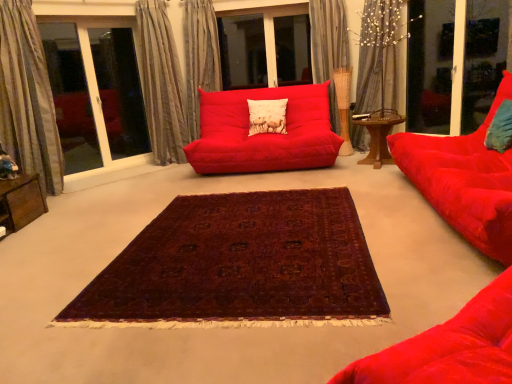
Question: Does matte red studio couch at center, the 2th studio couch positioned from the right, appear on the left side of matte white cushion at center, acting as the second pillow starting from the front?

Choices:
 (A) no
 (B) yes

Answer: (B)

Question: Would you say matte white cushion at center, which is the first pillow in back-to-front order, is part of matte red studio couch at center, the 2th studio couch positioned from the right,'s contents?

Choices:
 (A) yes
 (B) no

Answer: (A)

Question: From the image's perspective, is matte red studio couch at center, the 2th studio couch positioned from the right, beneath matte white cushion at center, positioned as the 1th pillow in left-to-right order?

Choices:
 (A) no
 (B) yes

Answer: (B)

Question: Are matte red studio couch at center, which is counted as the 1th studio couch, starting from the left, and matte white cushion at center, acting as the second pillow starting from the front, far apart?

Choices:
 (A) no
 (B) yes

Answer: (A)

Question: Is matte red studio couch at center, which is counted as the first studio couch, starting from the back, positioned behind matte white cushion at center, which is counted as the second pillow, starting from the right?

Choices:
 (A) no
 (B) yes

Answer: (A)

Question: Is matte red studio couch at center, which is counted as the first studio couch, starting from the back, smaller than matte white cushion at center, which is counted as the second pillow, starting from the right?

Choices:
 (A) yes
 (B) no

Answer: (B)

Question: From a real-world perspective, is transparent glass screen door at upper right located higher than silky gray curtain at upper left, which appears as the second curtain when viewed from the left?

Choices:
 (A) yes
 (B) no

Answer: (B)

Question: Is transparent glass screen door at upper right outside of silky gray curtain at upper left, which appears as the second curtain when viewed from the left?

Choices:
 (A) yes
 (B) no

Answer: (A)

Question: Does transparent glass screen door at upper right have a greater width compared to silky gray curtain at upper left, placed as the fourth curtain when sorted from right to left?

Choices:
 (A) no
 (B) yes

Answer: (A)

Question: Are transparent glass screen door at upper right and silky gray curtain at upper left, placed as the fourth curtain when sorted from right to left, located far from each other?

Choices:
 (A) no
 (B) yes

Answer: (B)

Question: From a real-world perspective, does transparent glass screen door at upper right sit lower than silky gray curtain at upper left, placed as the fourth curtain when sorted from right to left?

Choices:
 (A) no
 (B) yes

Answer: (B)

Question: From the image's perspective, would you say transparent glass screen door at upper right is shown under silky gray curtain at upper left, placed as the fourth curtain when sorted from right to left?

Choices:
 (A) yes
 (B) no

Answer: (B)

Question: Considering the relative positions of transparent glass bay window at upper left and matte white cushion at center, which is counted as the second pillow, starting from the right, in the image provided, is transparent glass bay window at upper left behind matte white cushion at center, which is counted as the second pillow, starting from the right,?

Choices:
 (A) yes
 (B) no

Answer: (B)